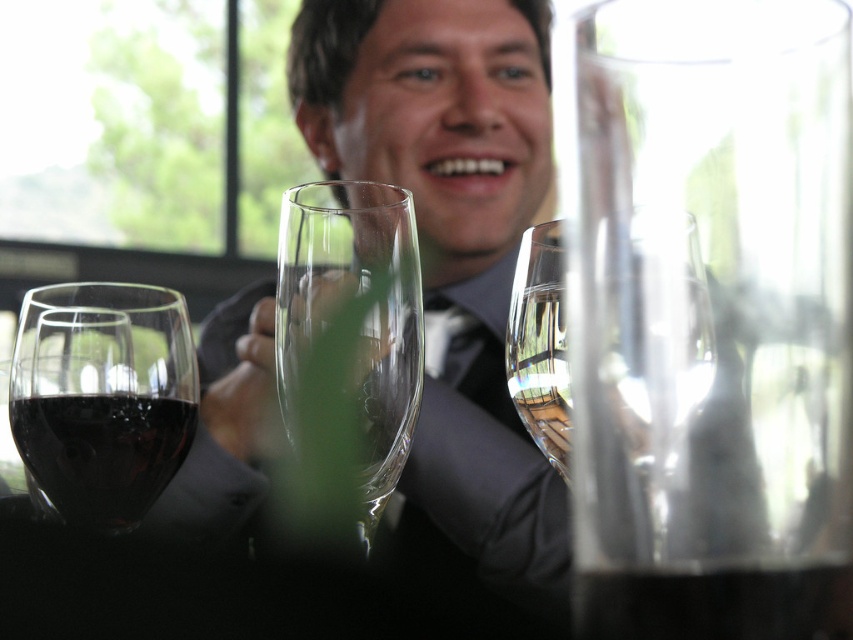
Question: Can you confirm if transparent glass at right is positioned to the right of transparent glass wine glass at center?

Choices:
 (A) yes
 (B) no

Answer: (B)

Question: Based on their relative distances, which object is nearer to the shiny dark red wine glass at left?

Choices:
 (A) transparent glass flute at center
 (B) transparent glass wine glass at center
 (C) transparent glass at right

Answer: (A)

Question: Is shiny dark red wine glass at left thinner than transparent glass at right?

Choices:
 (A) no
 (B) yes

Answer: (A)

Question: Is transparent glass at right below transparent glass wine glass at center?

Choices:
 (A) yes
 (B) no

Answer: (A)

Question: Among these objects, which one is farthest from the camera?

Choices:
 (A) transparent glass flute at center
 (B) shiny dark red wine glass at left
 (C) transparent glass at right

Answer: (B)

Question: Among these objects, which one is nearest to the camera?

Choices:
 (A) transparent glass at right
 (B) transparent glass flute at center
 (C) transparent glass wine glass at center

Answer: (A)